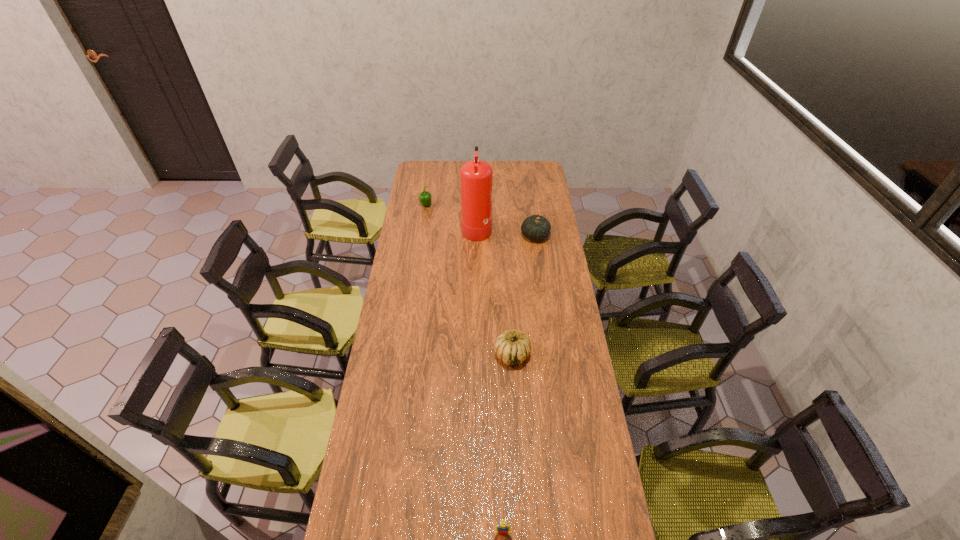
This screenshot has width=960, height=540. What are the coordinates of `free region located 0.150m on the left of the right gourd` in the screenshot? It's located at (492, 236).

I want to click on vacant space situated 0.060m on the left of the leftmost object, so click(410, 206).

This screenshot has height=540, width=960. I want to click on vacant point located on the front of the second nearest object, so click(517, 438).

Image resolution: width=960 pixels, height=540 pixels. I want to click on object that is positioned at the left edge, so click(x=425, y=197).

At what (x,y) coordinates should I click in order to perform the action: click on object at the right edge. Please return your answer as a coordinate pair (x, y). This screenshot has width=960, height=540. Looking at the image, I should click on (536, 227).

Locate an element on the screen. The width and height of the screenshot is (960, 540). free space at the left edge of the desktop is located at coordinates (381, 394).

In the image, there is a desktop. At what (x,y) coordinates should I click in order to perform the action: click on vacant space at the right edge. Please return your answer as a coordinate pair (x, y). The width and height of the screenshot is (960, 540). Looking at the image, I should click on (598, 518).

The width and height of the screenshot is (960, 540). Find the location of `free spot at the far right corner of the desktop`. free spot at the far right corner of the desktop is located at coordinates (525, 179).

You are a GUI agent. You are given a task and a screenshot of the screen. Output one action in this format:
    pyautogui.click(x=<x>, y=<y>)
    Task: Click on the unoccupied area between the fire extinguisher and the farther gourd
    Image resolution: width=960 pixels, height=540 pixels.
    Given the screenshot: What is the action you would take?
    pyautogui.click(x=506, y=231)

Identify the location of free space between the right gourd and the fourth farthest object. The image size is (960, 540). (523, 295).